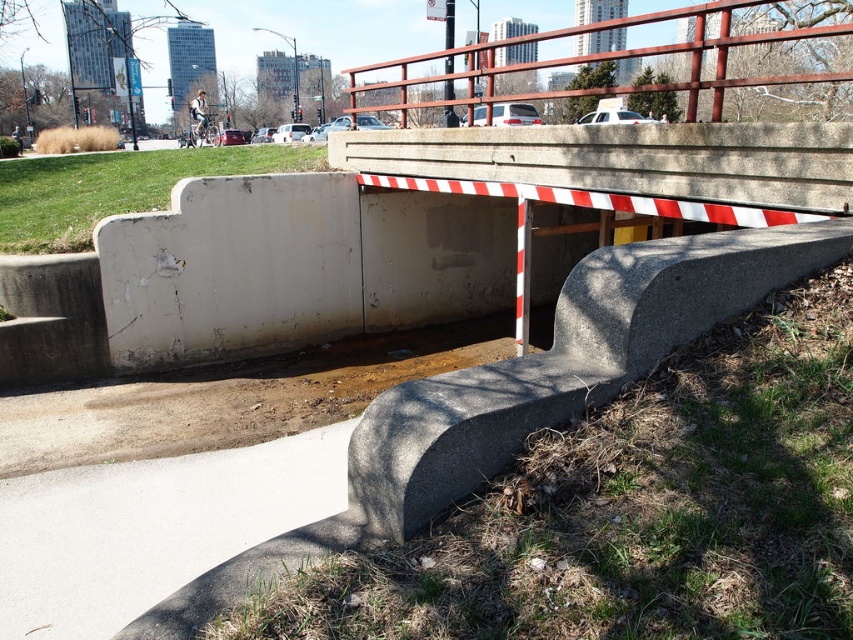
From the picture: Between white concrete pavement at lower left and rustic wood rail at upper center, which one appears on the right side from the viewer's perspective?

rustic wood rail at upper center is more to the right.

Describe the element at coordinates (151, 528) in the screenshot. I see `white concrete pavement at lower left` at that location.

This screenshot has height=640, width=853. I want to click on white concrete pavement at lower left, so click(151, 528).

Does rustic wood rail at upper center appear under white striped concrete barrier at center?

No.

Is point (695, 72) behind point (668, 209)?

No, (695, 72) is closer to viewer.

Where is `rustic wood rail at upper center`? This screenshot has width=853, height=640. rustic wood rail at upper center is located at coordinates (618, 60).

Could you measure the distance between white concrete pavement at lower left and white striped concrete barrier at center?

17.00 feet

Between white concrete pavement at lower left and white striped concrete barrier at center, which one appears on the right side from the viewer's perspective?

From the viewer's perspective, white striped concrete barrier at center appears more on the right side.

Does point (112, 524) come behind point (689, 218)?

No, it is not.

The width and height of the screenshot is (853, 640). I want to click on white concrete pavement at lower left, so click(151, 528).